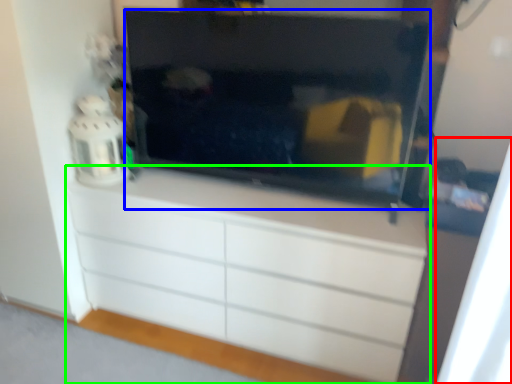
Question: Which is farther away from curtain (highlighted by a red box)? television (highlighted by a blue box) or chest of drawers (highlighted by a green box)?

Choices:
 (A) television
 (B) chest of drawers

Answer: (A)